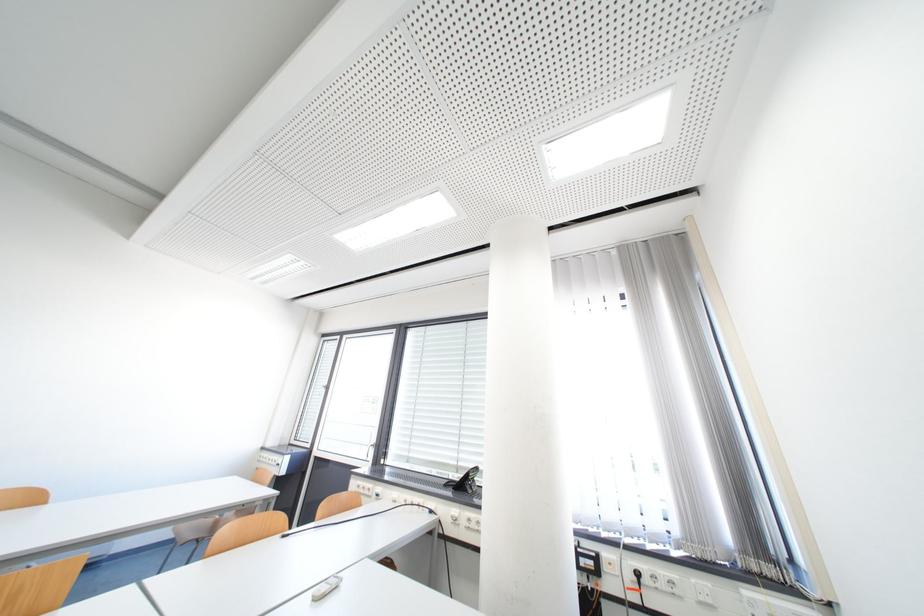
Find the location of a particular element. The image size is (924, 616). white remote control is located at coordinates (325, 588).